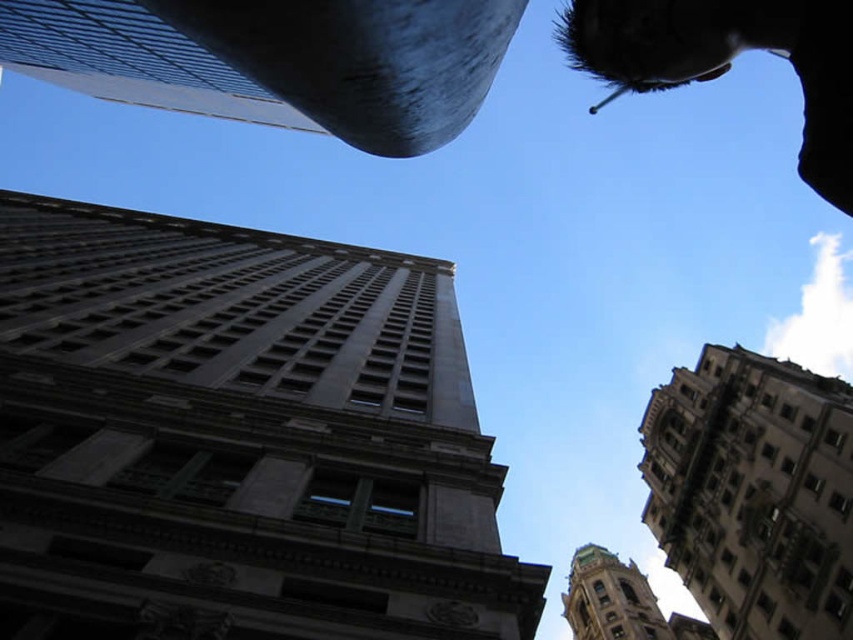
Which of these two, gray stone tower at center or brown stone tower at upper right, stands taller?

brown stone tower at upper right is taller.

Can you confirm if gray stone tower at center is smaller than brown stone tower at upper right?

Incorrect, gray stone tower at center is not smaller in size than brown stone tower at upper right.

Based on the photo, who is more forward, [373,579] or [706,371]?

Point [373,579] is more forward.

You are a GUI agent. You are given a task and a screenshot of the screen. Output one action in this format:
    pyautogui.click(x=<x>, y=<y>)
    Task: Click on the gray stone tower at center
    Image resolution: width=853 pixels, height=640 pixels.
    Given the screenshot: What is the action you would take?
    pyautogui.click(x=238, y=438)

Who is positioned more to the right, brown stone tower at upper right or green copper tower at lower right?

From the viewer's perspective, green copper tower at lower right appears more on the right side.

Does brown stone tower at upper right have a smaller size compared to green copper tower at lower right?

Incorrect, brown stone tower at upper right is not smaller in size than green copper tower at lower right.

Describe the element at coordinates (753, 492) in the screenshot. I see `brown stone tower at upper right` at that location.

The height and width of the screenshot is (640, 853). Find the location of `brown stone tower at upper right`. brown stone tower at upper right is located at coordinates (753, 492).

Between gray stone tower at center and green copper tower at lower right, which one appears on the left side from the viewer's perspective?

gray stone tower at center is more to the left.

At what (x,y) coordinates should I click in order to perform the action: click on gray stone tower at center. Please return your answer as a coordinate pair (x, y). Image resolution: width=853 pixels, height=640 pixels. Looking at the image, I should click on (238, 438).